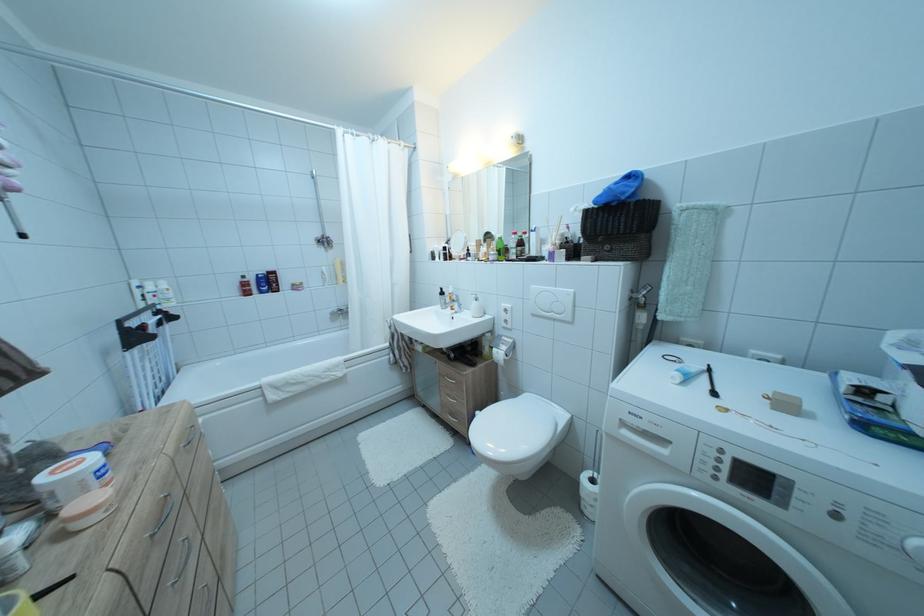
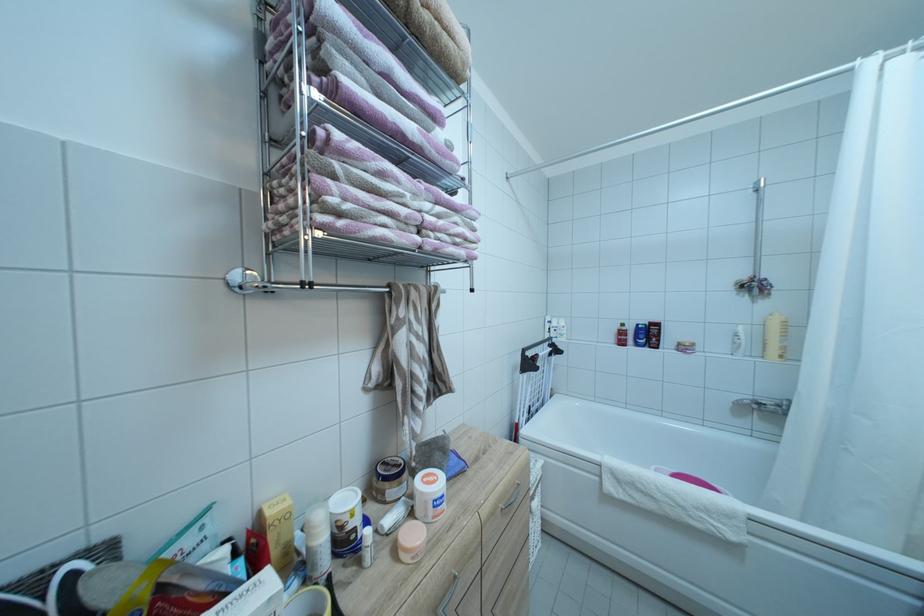
Locate, in the second image, the point that corresponds to pixel 89 467 in the first image.

(442, 487)